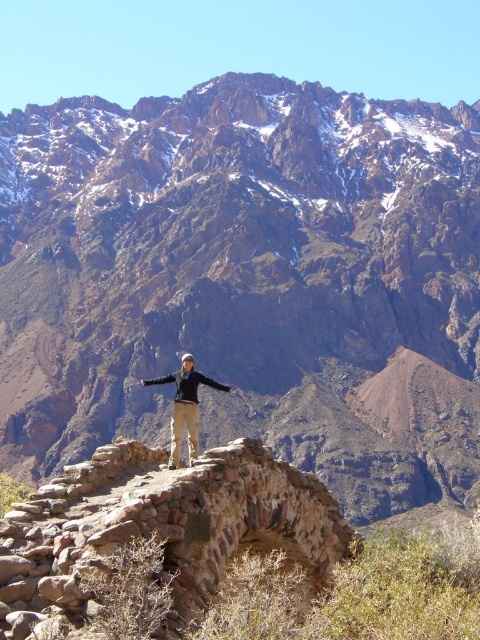
You are navigating a mountain trail and come across two landmarks marked as point (163, 108) and point (180, 445). Which point is closer to your current position if you are standing at the base of the mountain?

Point (180, 445) is closer to your current position because it is in front of point (163, 108), which is behind it.

You are a hiker who has reached the stone structure. Looking ahead, you see the brown rocky mountain range at upper center and the khaki pants at center. Which of these two landmarks is positioned to the right of the other?

The brown rocky mountain range at upper center is to the right of the khaki pants at center.

You are a hiker who has reached the stone structure where the person is standing. You want to take a photo of the brown rocky mountain range at upper center. Where should you position yourself relative to the point marked as point [248,280] to capture the entire mountain range in your camera frame?

To capture the entire brown rocky mountain range at upper center, you should position yourself directly at point [248,280] since the mountain range is located exactly at that coordinate.